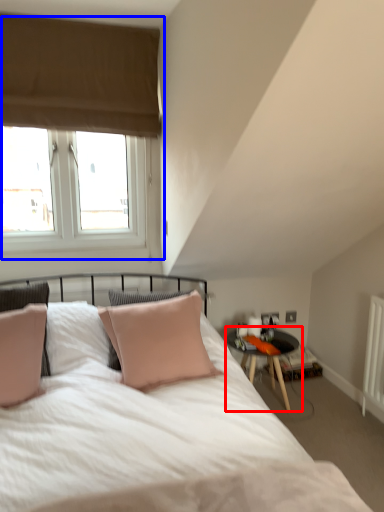
Question: Which of the following is the closest to the observer, table (highlighted by a red box) or window (highlighted by a blue box)?

Choices:
 (A) table
 (B) window

Answer: (B)